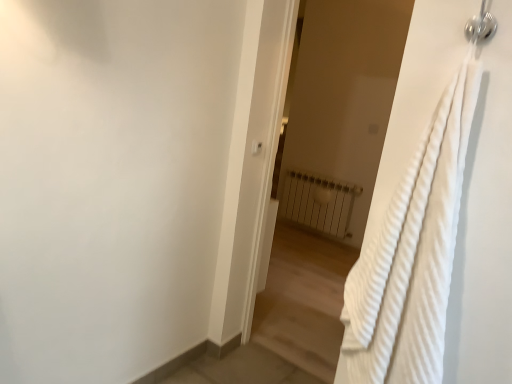
Question: From a real-world perspective, is white textured towel at right located higher than white textured towel at right?

Choices:
 (A) yes
 (B) no

Answer: (A)

Question: Is white textured towel at right with white textured towel at right?

Choices:
 (A) no
 (B) yes

Answer: (A)

Question: From a real-world perspective, is white textured towel at right positioned under white textured towel at right based on gravity?

Choices:
 (A) no
 (B) yes

Answer: (A)

Question: Can you confirm if white textured towel at right is wider than white textured towel at right?

Choices:
 (A) yes
 (B) no

Answer: (A)

Question: Is there a large distance between white textured towel at right and white textured towel at right?

Choices:
 (A) no
 (B) yes

Answer: (B)

Question: From the image's perspective, is white metallic radiator at center located above or below white textured towel at right?

Choices:
 (A) below
 (B) above

Answer: (B)

Question: Would you say white metallic radiator at center is inside or outside white textured towel at right?

Choices:
 (A) outside
 (B) inside

Answer: (A)

Question: In terms of width, does white metallic radiator at center look wider or thinner when compared to white textured towel at right?

Choices:
 (A) thin
 (B) wide

Answer: (A)

Question: From their relative heights in the image, would you say white metallic radiator at center is taller or shorter than white textured towel at right?

Choices:
 (A) short
 (B) tall

Answer: (A)

Question: In terms of height, does white plastic light switch at upper center look taller or shorter compared to white metallic radiator at center?

Choices:
 (A) short
 (B) tall

Answer: (A)

Question: From a real-world perspective, is white plastic light switch at upper center positioned above or below white metallic radiator at center?

Choices:
 (A) below
 (B) above

Answer: (B)

Question: Considering the positions of white plastic light switch at upper center and white metallic radiator at center in the image, is white plastic light switch at upper center wider or thinner than white metallic radiator at center?

Choices:
 (A) wide
 (B) thin

Answer: (B)

Question: Based on their sizes in the image, would you say white plastic light switch at upper center is bigger or smaller than white metallic radiator at center?

Choices:
 (A) small
 (B) big

Answer: (A)

Question: Considering their positions, is white textured towel at right located in front of or behind white plastic light switch at upper center?

Choices:
 (A) behind
 (B) front

Answer: (B)

Question: Considering the positions of white textured towel at right and white plastic light switch at upper center in the image, is white textured towel at right bigger or smaller than white plastic light switch at upper center?

Choices:
 (A) small
 (B) big

Answer: (B)